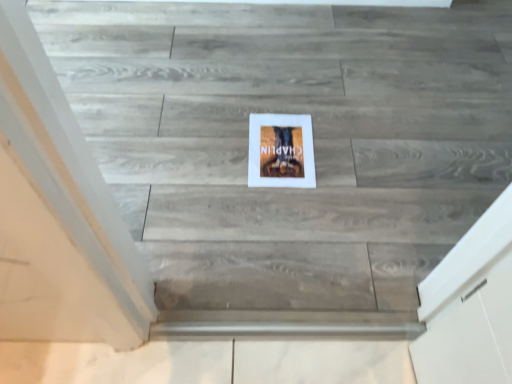
Image resolution: width=512 pixels, height=384 pixels. I want to click on white matte picture frame at center, so click(280, 150).

The image size is (512, 384). Describe the element at coordinates (280, 150) in the screenshot. I see `white matte picture frame at center` at that location.

This screenshot has height=384, width=512. I want to click on white matte picture frame at center, so click(x=280, y=150).